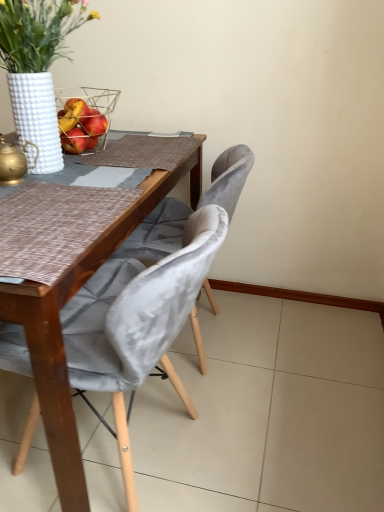
Where is `vacant space to the right of gold metallic teapot at left`? vacant space to the right of gold metallic teapot at left is located at coordinates (59, 184).